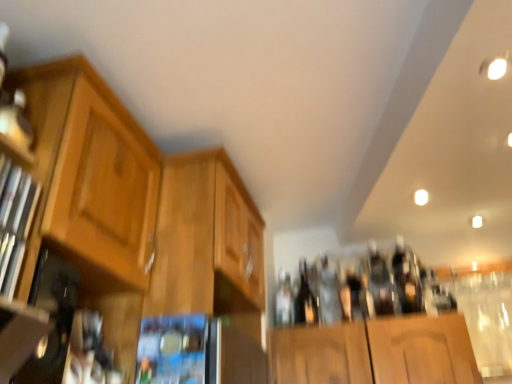
Question: Does black glass beer bottle at center come in front of wooden cabinet at center, the first cabinetry positioned from the right?

Choices:
 (A) no
 (B) yes

Answer: (A)

Question: Does black glass beer bottle at center appear on the left side of wooden cabinet at center, which ranks as the second cabinetry in left-to-right order?

Choices:
 (A) yes
 (B) no

Answer: (B)

Question: Considering the relative sizes of black glass beer bottle at center and wooden cabinet at center, the first cabinetry positioned from the right, in the image provided, is black glass beer bottle at center taller than wooden cabinet at center, the first cabinetry positioned from the right,?

Choices:
 (A) no
 (B) yes

Answer: (A)

Question: From a real-world perspective, is black glass beer bottle at center beneath wooden cabinet at center, the first cabinetry positioned from the right?

Choices:
 (A) no
 (B) yes

Answer: (B)

Question: Is black glass beer bottle at center far away from wooden cabinet at center, the first cabinetry positioned from the right?

Choices:
 (A) yes
 (B) no

Answer: (B)

Question: From the image's perspective, relative to light brown wood cabinet at left, which ranks as the second cabinetry in right-to-left order, is metallic silver microwave at center above or below?

Choices:
 (A) below
 (B) above

Answer: (A)

Question: Is metallic silver microwave at center in front of or behind light brown wood cabinet at left, the 1th cabinetry positioned from the left, in the image?

Choices:
 (A) behind
 (B) front

Answer: (A)

Question: Would you say metallic silver microwave at center is inside or outside light brown wood cabinet at left, which ranks as the second cabinetry in right-to-left order?

Choices:
 (A) outside
 (B) inside

Answer: (A)

Question: Considering the positions of metallic silver microwave at center and light brown wood cabinet at left, the 1th cabinetry positioned from the left, in the image, is metallic silver microwave at center wider or thinner than light brown wood cabinet at left, the 1th cabinetry positioned from the left,?

Choices:
 (A) thin
 (B) wide

Answer: (A)

Question: Is wooden cabinet at center, which ranks as the second cabinetry in left-to-right order, bigger or smaller than black glass beer bottle at center?

Choices:
 (A) small
 (B) big

Answer: (B)

Question: In terms of height, does wooden cabinet at center, the first cabinetry positioned from the right, look taller or shorter compared to black glass beer bottle at center?

Choices:
 (A) tall
 (B) short

Answer: (A)

Question: Is wooden cabinet at center, the first cabinetry positioned from the right, wider or thinner than black glass beer bottle at center?

Choices:
 (A) wide
 (B) thin

Answer: (A)

Question: Choose the correct answer: Is wooden cabinet at center, which ranks as the second cabinetry in left-to-right order, inside black glass beer bottle at center or outside it?

Choices:
 (A) outside
 (B) inside

Answer: (A)

Question: Visually, is black glass beer bottle at center positioned to the left or to the right of clear glass bottle at center, which is the first bottle from right to left?

Choices:
 (A) left
 (B) right

Answer: (A)

Question: Looking at the image, does black glass beer bottle at center seem bigger or smaller compared to clear glass bottle at center, the second bottle in the left-to-right sequence?

Choices:
 (A) small
 (B) big

Answer: (B)